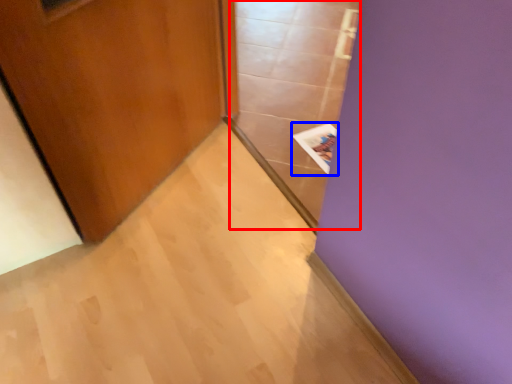
Question: Which object is closer to the camera taking this photo, glass door (highlighted by a red box) or magazine (highlighted by a blue box)?

Choices:
 (A) glass door
 (B) magazine

Answer: (A)